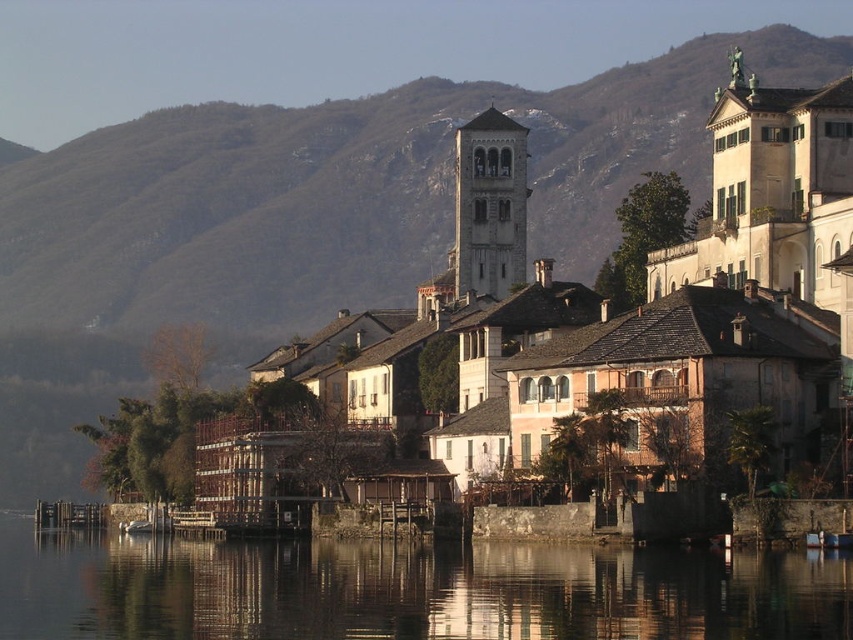
Between transparent water at lower center and gray stone bell tower at center, which one appears on the right side from the viewer's perspective?

Positioned to the right is gray stone bell tower at center.

Does point (167, 614) come farther from viewer compared to point (486, 198)?

No, (167, 614) is closer to viewer.

Locate an element on the screen. Image resolution: width=853 pixels, height=640 pixels. transparent water at lower center is located at coordinates (407, 589).